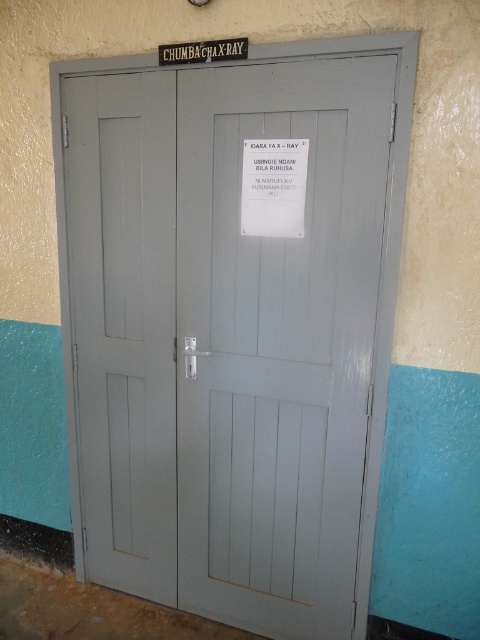
In the scene shown: Between white paper at center and metallic signboard at upper center, which one has less height?

With less height is metallic signboard at upper center.

Identify the location of white paper at center. (275, 170).

Is point (55, 108) positioned after point (233, 45)?

Yes, point (55, 108) is behind point (233, 45).

Between point (319, 294) and point (164, 44), which one is positioned behind?

Point (164, 44)

Between point (168, 168) and point (244, 49), which one is positioned behind?

Positioned behind is point (168, 168).

Locate an element on the screen. The image size is (480, 640). painted wood door at center is located at coordinates (230, 326).

Is matte gray door at center positioned behind metallic signboard at upper center?

Yes.

Does point (119, 81) lie behind point (172, 48)?

That is True.

The height and width of the screenshot is (640, 480). What are the coordinates of `matte gray door at center` in the screenshot? It's located at (123, 323).

Find the location of a particular element. Image resolution: width=480 pixels, height=640 pixels. matte gray door at center is located at coordinates (123, 323).